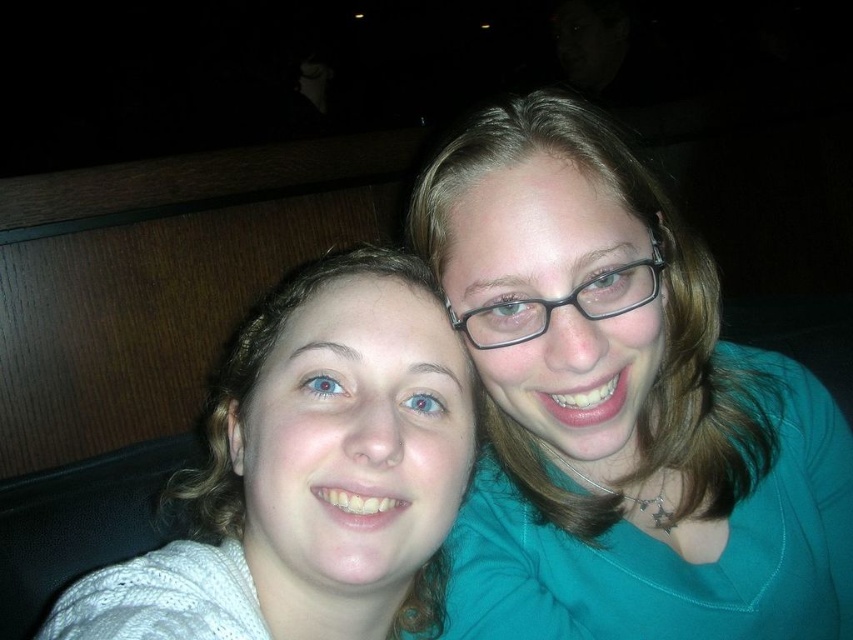
Question: Which object appears farthest from the camera in this image?

Choices:
 (A) teal fabric shirt at upper right
 (B) white knit sweater at left

Answer: (A)

Question: From the image, what is the correct spatial relationship of teal fabric shirt at upper right in relation to white knit sweater at left?

Choices:
 (A) below
 (B) above

Answer: (B)

Question: Can you confirm if teal fabric shirt at upper right is positioned above white knit sweater at left?

Choices:
 (A) no
 (B) yes

Answer: (B)

Question: Does teal fabric shirt at upper right come in front of white knit sweater at left?

Choices:
 (A) yes
 (B) no

Answer: (B)

Question: Which point is farther from the camera taking this photo?

Choices:
 (A) (637, 234)
 (B) (210, 588)

Answer: (A)

Question: Which point is farther from the camera taking this photo?

Choices:
 (A) (281, 630)
 (B) (473, 598)

Answer: (B)